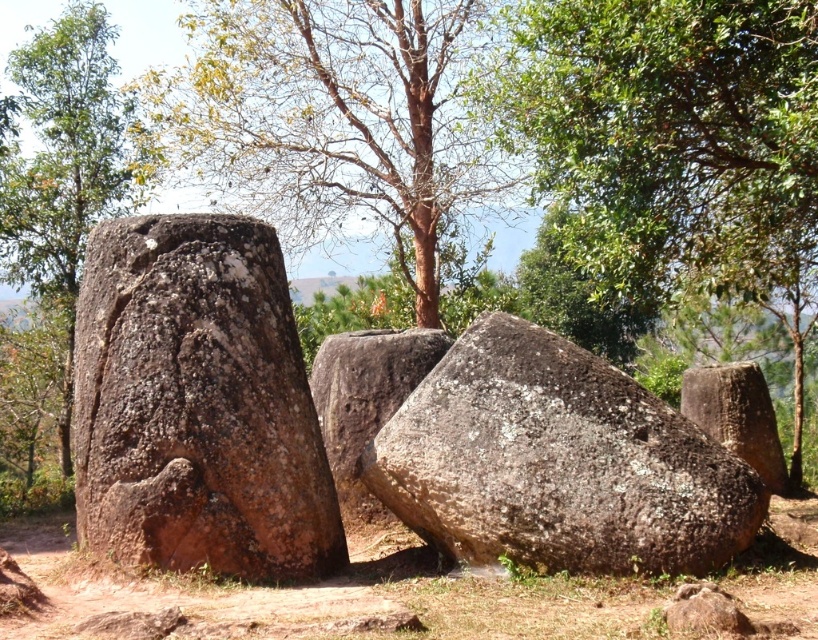
Is brown rough rock at center bigger than brown rough boulder at center?

Correct, brown rough rock at center is larger in size than brown rough boulder at center.

Can you confirm if brown rough rock at center is positioned below brown rough boulder at center?

Correct, brown rough rock at center is located below brown rough boulder at center.

Identify the location of brown rough rock at center. (556, 461).

Can you confirm if brown rough boulder at center is shorter than brown rough boulder at right?

No.

Does brown rough boulder at center come behind brown rough boulder at right?

No, brown rough boulder at center is in front of brown rough boulder at right.

Image resolution: width=818 pixels, height=640 pixels. I want to click on brown rough boulder at center, so click(x=365, y=401).

Identify the location of brown rough boulder at center. (365, 401).

Is brown bark tree at center below brown rough rock at center?

No, brown bark tree at center is not below brown rough rock at center.

Does brown bark tree at center have a smaller size compared to brown rough rock at center?

Indeed, brown bark tree at center has a smaller size compared to brown rough rock at center.

Find the location of a particular element. The image size is (818, 640). brown bark tree at center is located at coordinates (335, 118).

Where is `brown bark tree at center`? Image resolution: width=818 pixels, height=640 pixels. brown bark tree at center is located at coordinates (335, 118).